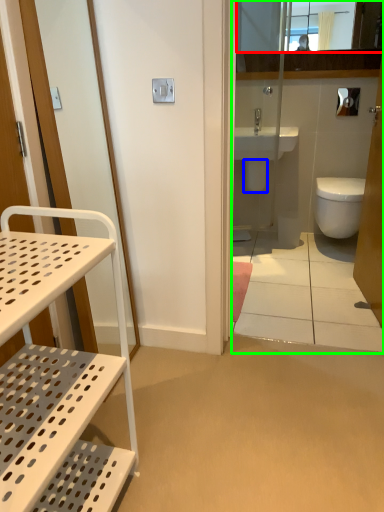
Question: Based on their relative distances, which object is nearer to mirror (highlighted by a red box)? Choose from bidet (highlighted by a blue box) and corridor (highlighted by a green box).

Choices:
 (A) bidet
 (B) corridor

Answer: (B)